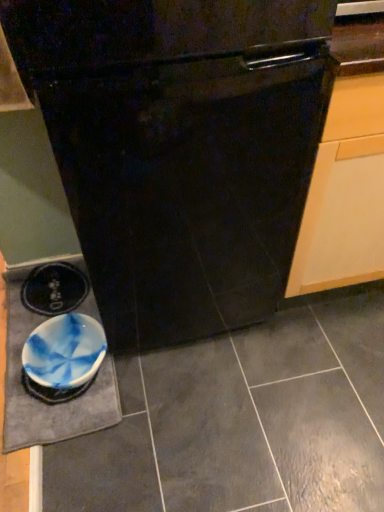
What is the approximate width of black glossy oven at center?

66.08 centimeters.

What do you see at coordinates (180, 149) in the screenshot?
I see `black glossy oven at center` at bounding box center [180, 149].

What do you see at coordinates (64, 351) in the screenshot? I see `blue marbled bowl at lower left` at bounding box center [64, 351].

This screenshot has width=384, height=512. Find the location of `black glossy oven at center`. black glossy oven at center is located at coordinates (180, 149).

Is blue marbled bowl at lower left facing away from blue marbled slate at lower left?

Absolutely, blue marbled bowl at lower left is directed away from blue marbled slate at lower left.

Considering the relative sizes of blue marbled bowl at lower left and blue marbled slate at lower left in the image provided, is blue marbled bowl at lower left smaller than blue marbled slate at lower left?

Correct, blue marbled bowl at lower left occupies less space than blue marbled slate at lower left.

Consider the image. Which is correct: blue marbled bowl at lower left is inside blue marbled slate at lower left, or outside of it?

blue marbled bowl at lower left is spatially positioned inside blue marbled slate at lower left.

Could you tell me if blue marbled slate at lower left is turned towards black glossy oven at center?

No, blue marbled slate at lower left is not turned towards black glossy oven at center.

The height and width of the screenshot is (512, 384). Find the location of `oven above the blue marbled slate at lower left (from a real-world perspective)`. oven above the blue marbled slate at lower left (from a real-world perspective) is located at coordinates (180, 149).

Which object is more forward, blue marbled slate at lower left or black glossy oven at center?

black glossy oven at center is in front.

Measure the distance between blue marbled slate at lower left and black glossy oven at center.

23.29 inches.

Is point (15, 312) farther from camera compared to point (70, 378)?

That is True.

Considering the positions of objects blue marbled slate at lower left and blue marbled bowl at lower left in the image provided, who is more to the left, blue marbled slate at lower left or blue marbled bowl at lower left?

blue marbled slate at lower left.

Is blue marbled slate at lower left positioned beyond the bounds of blue marbled bowl at lower left?

No.

Is black glossy oven at center positioned beyond the bounds of blue marbled bowl at lower left?

black glossy oven at center lies outside blue marbled bowl at lower left's area.

From a real-world perspective, which is physically below, black glossy oven at center or blue marbled bowl at lower left?

blue marbled bowl at lower left is physically lower.

What's the angular difference between black glossy oven at center and blue marbled bowl at lower left's facing directions?

87 degrees.

Which object is wider, black glossy oven at center or blue marbled bowl at lower left?

black glossy oven at center.

Can you confirm if black glossy oven at center is smaller than blue marbled slate at lower left?

Actually, black glossy oven at center might be larger than blue marbled slate at lower left.

From a real-world perspective, is black glossy oven at center physically located above or below blue marbled slate at lower left?

From a real-world perspective, black glossy oven at center is physically above blue marbled slate at lower left.

Are black glossy oven at center and blue marbled slate at lower left far apart?

They are positioned close to each other.

In the scene shown: How much distance is there between black glossy oven at center and blue marbled slate at lower left?

black glossy oven at center is 23.29 inches away from blue marbled slate at lower left.

You are a GUI agent. You are given a task and a screenshot of the screen. Output one action in this format:
    pyautogui.click(x=<x>, y=<y>)
    Task: Click on the bowl below the black glossy oven at center (from a real-world perspective)
    The height and width of the screenshot is (512, 384).
    Given the screenshot: What is the action you would take?
    pyautogui.click(x=64, y=351)

From a real-world perspective, is blue marbled bowl at lower left on black glossy oven at center?

Incorrect, from a real-world perspective, blue marbled bowl at lower left is lower than black glossy oven at center.

Between point (75, 353) and point (26, 45), which one is positioned behind?

Point (75, 353)

Who is shorter, blue marbled bowl at lower left or black glossy oven at center?

blue marbled bowl at lower left.

Where is `bowl above the blue marbled slate at lower left (from a real-world perspective)`? The width and height of the screenshot is (384, 512). bowl above the blue marbled slate at lower left (from a real-world perspective) is located at coordinates (64, 351).

The image size is (384, 512). I want to click on slate located on the left of black glossy oven at center, so click(x=43, y=403).

Estimate the real-world distances between objects in this image. Which object is further from black glossy oven at center, blue marbled bowl at lower left or blue marbled slate at lower left?

Based on the image, blue marbled slate at lower left appears to be further to black glossy oven at center.

Which object lies further to the anchor point blue marbled bowl at lower left, black glossy oven at center or blue marbled slate at lower left?

black glossy oven at center.

Based on their spatial positions, is blue marbled slate at lower left or blue marbled bowl at lower left further from black glossy oven at center?

blue marbled slate at lower left is positioned further to the anchor black glossy oven at center.

Which object lies further to the anchor point blue marbled slate at lower left, blue marbled bowl at lower left or black glossy oven at center?

black glossy oven at center is further to blue marbled slate at lower left.

When comparing their distances from blue marbled slate at lower left, does black glossy oven at center or blue marbled bowl at lower left seem further?

black glossy oven at center is positioned further to the anchor blue marbled slate at lower left.

When comparing their distances from blue marbled bowl at lower left, does blue marbled slate at lower left or black glossy oven at center seem closer?

Among the two, blue marbled slate at lower left is located nearer to blue marbled bowl at lower left.

This screenshot has height=512, width=384. What are the coordinates of `slate between black glossy oven at center and blue marbled bowl at lower left along the z-axis` in the screenshot? It's located at (43, 403).